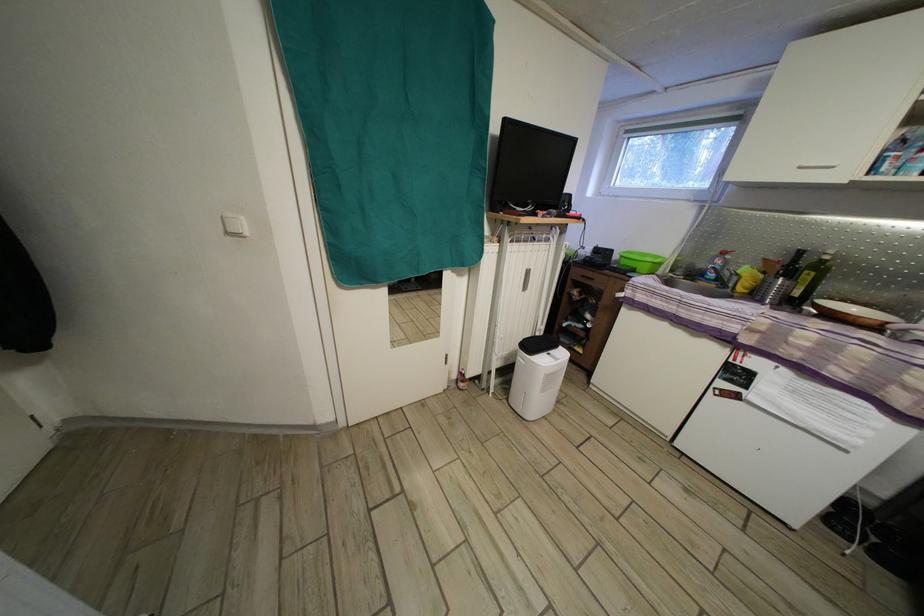
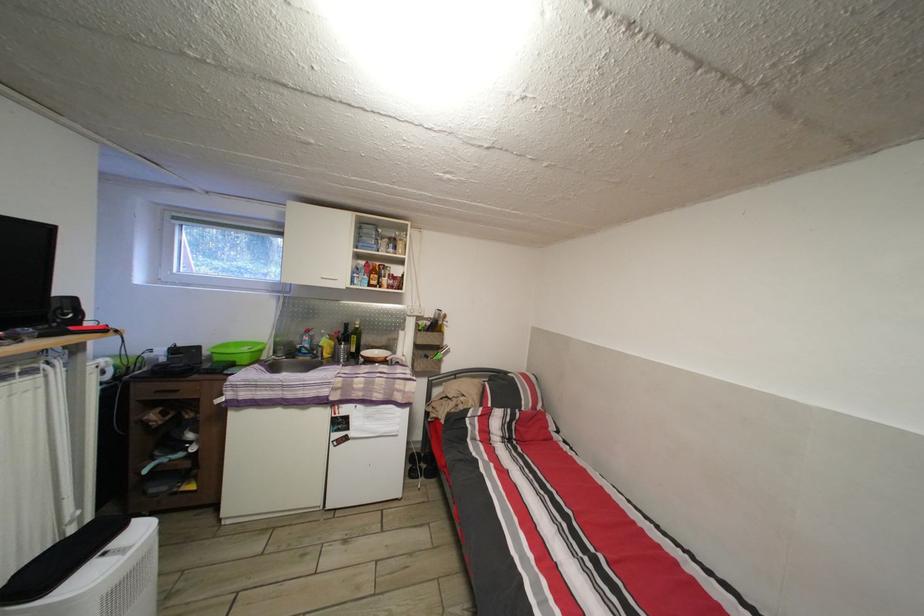
In the second image, find the point that corresponds to point (815, 282) in the first image.

(360, 345)